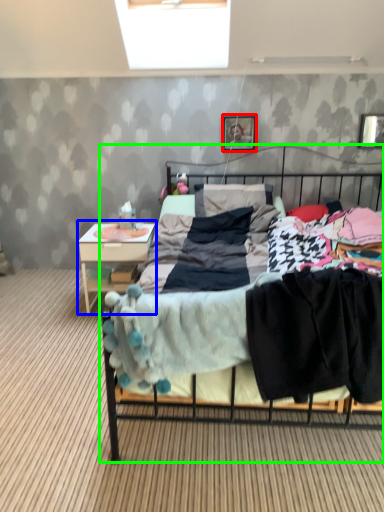
Question: Which object is positioned closest to picture frame (highlighted by a red box)? Select from nightstand (highlighted by a blue box) and bed (highlighted by a green box).

Choices:
 (A) nightstand
 (B) bed

Answer: (B)